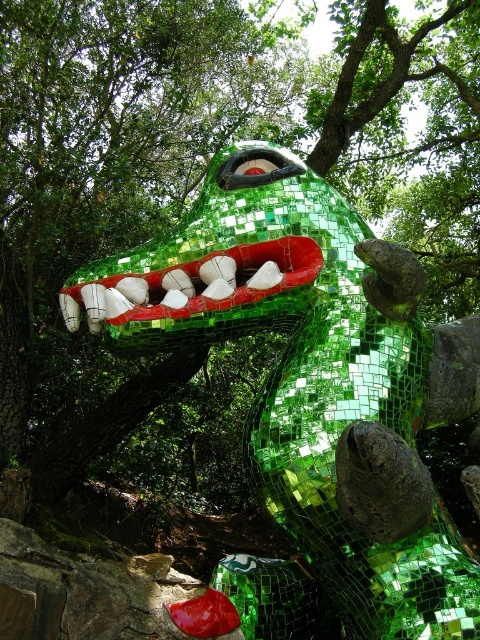
You are an artist planning to paint a mural inspired by this scene. You want to ensure the green mosaic dragon at center and the shiny green mosaic mouth at center are proportionally accurate. Which one should you make taller in your painting?

The green mosaic dragon at center should be made taller than the shiny green mosaic mouth at center in the painting, as it is taller in the original scene.

You are standing in a park and see the green mosaic dragon at center. If you walk directly towards the dragon, which direction should you head? Please provide your answer based on the dragon being at the specified coordinates.

The green mosaic dragon at center is located at coordinates approximately 0.616 on the x and y axis. Since it is at the center of the image, you should walk straight ahead to reach it.